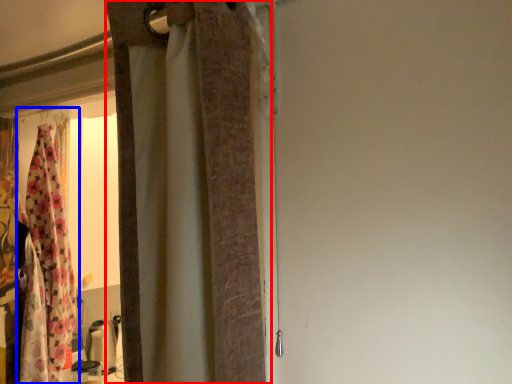
Question: Which object appears farthest to the camera in this image, curtain (highlighted by a red box) or curtain (highlighted by a blue box)?

Choices:
 (A) curtain
 (B) curtain

Answer: (B)